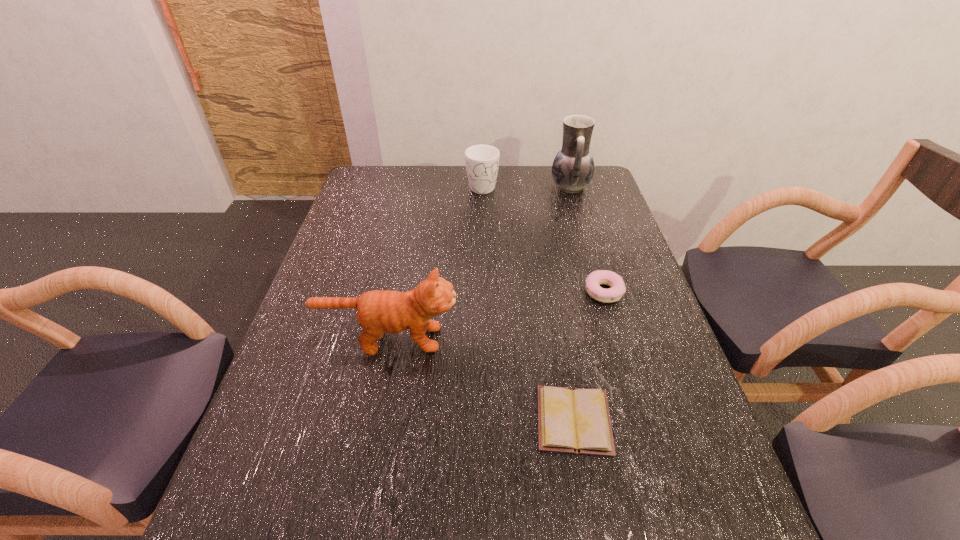
Locate an element on the screen. blank region between the mug and the fourth tallest object is located at coordinates (542, 238).

You are a GUI agent. You are given a task and a screenshot of the screen. Output one action in this format:
    pyautogui.click(x=<x>, y=<y>)
    Task: Click on the unoccupied position between the tallest object and the doughnut
    The image size is (960, 540).
    Given the screenshot: What is the action you would take?
    pyautogui.click(x=587, y=239)

Identify the location of vacant region between the nearest object and the third tallest object. (528, 302).

This screenshot has height=540, width=960. In order to click on free space that is in between the nearest object and the leftmost object in this screenshot , I will do `click(481, 379)`.

Locate an element on the screen. The width and height of the screenshot is (960, 540). vacant area between the leftmost object and the nearest object is located at coordinates (481, 379).

Where is `vacant space that is in between the diary and the fourth object from right to left`? Image resolution: width=960 pixels, height=540 pixels. vacant space that is in between the diary and the fourth object from right to left is located at coordinates (528, 302).

Where is `object that is the third closest to the shortest object`? This screenshot has height=540, width=960. object that is the third closest to the shortest object is located at coordinates (573, 167).

You are a GUI agent. You are given a task and a screenshot of the screen. Output one action in this format:
    pyautogui.click(x=<x>, y=<y>)
    Task: Click on the object that ranks as the fourth closest to the tallest object
    The width and height of the screenshot is (960, 540).
    Given the screenshot: What is the action you would take?
    pyautogui.click(x=577, y=420)

This screenshot has height=540, width=960. What are the coordinates of `vacant space that satisfies the following two spatial constraints: 1. on the face of the diary; 2. on the left side of the second tallest object` in the screenshot? It's located at (372, 420).

Where is `free space that satisfies the following two spatial constraints: 1. on the side of the fourth object from right to left with the handle; 2. on the face of the fourth shortest object`? Image resolution: width=960 pixels, height=540 pixels. free space that satisfies the following two spatial constraints: 1. on the side of the fourth object from right to left with the handle; 2. on the face of the fourth shortest object is located at coordinates (483, 339).